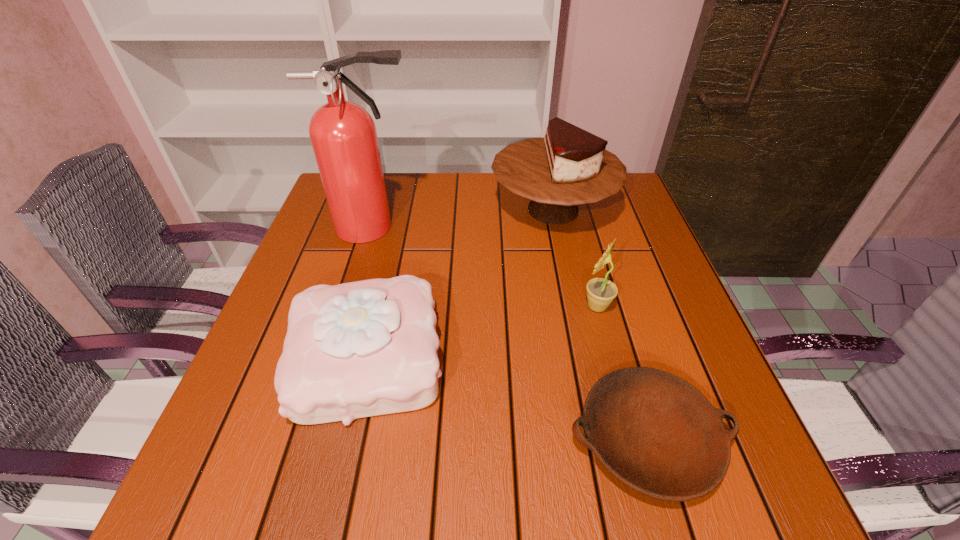
This screenshot has width=960, height=540. Find the location of `vacant space that's between the plate and the fire extinguisher`. vacant space that's between the plate and the fire extinguisher is located at coordinates (511, 334).

Choose which object is the nearest neighbor to the taller cake. Please provide its 2D coordinates. Your answer should be formatted as a tuple, i.e. [(x, y)], where the tuple contains the x and y coordinates of a point satisfying the conditions above.

[(600, 291)]

Identify the location of object that stands as the third closest to the left cake. (655, 432).

Find the location of a particular element. Image resolution: width=960 pixels, height=540 pixels. free space that satisfies the following two spatial constraints: 1. on the front side of the nearer cake; 2. on the right side of the plate is located at coordinates (348, 440).

Identify the location of vacant area that satisfies the following two spatial constraints: 1. on the front side of the shortest object; 2. on the right side of the taller cake. (602, 440).

Where is `vacant area in the image that satisfies the following two spatial constraints: 1. on the back side of the second tallest object; 2. on the right side of the fourth tallest object`? Image resolution: width=960 pixels, height=540 pixels. vacant area in the image that satisfies the following two spatial constraints: 1. on the back side of the second tallest object; 2. on the right side of the fourth tallest object is located at coordinates (401, 210).